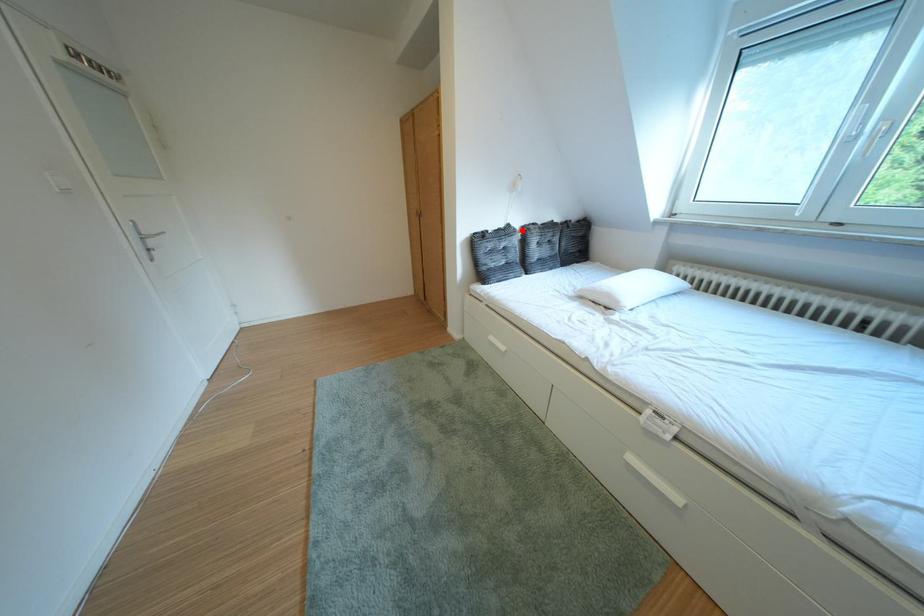
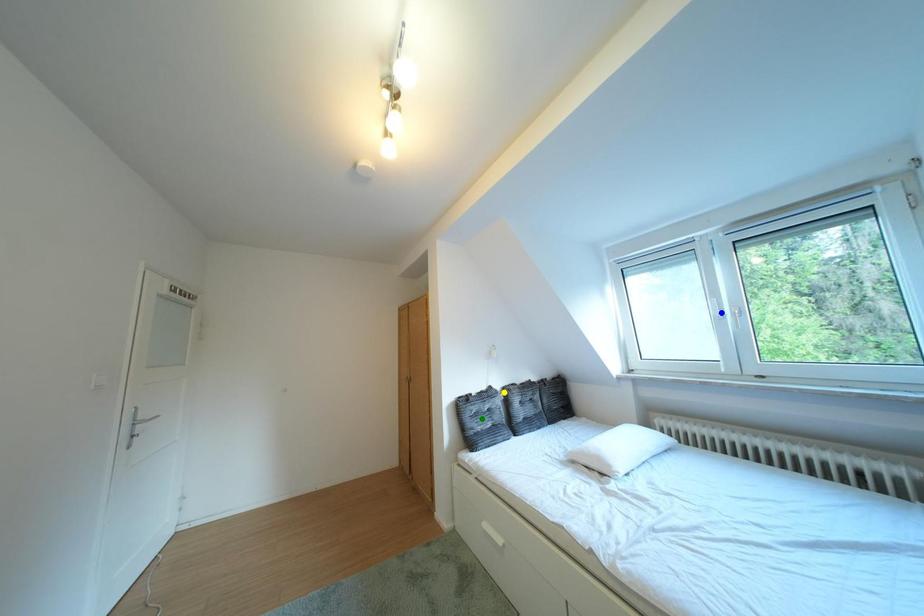
Question: I am providing you with two images of the same scene from different viewpoints. A red point is marked on the first image. You are given multiple points on the second image. Which mark in image 2 goes with the point in image 1?

Choices:
 (A) green point
 (B) blue point
 (C) yellow point

Answer: (C)